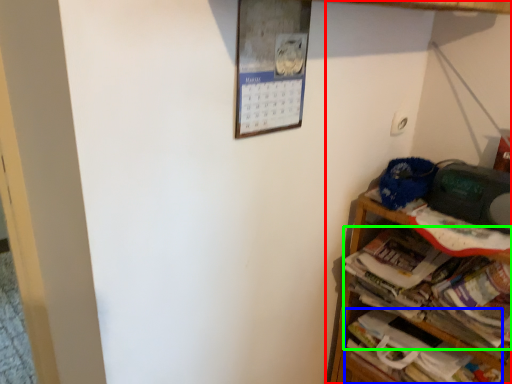
Question: Based on their relative distances, which object is farther from shelf (highlighted by a red box)? Choose from book (highlighted by a blue box) and magazine (highlighted by a green box).

Choices:
 (A) book
 (B) magazine

Answer: (B)